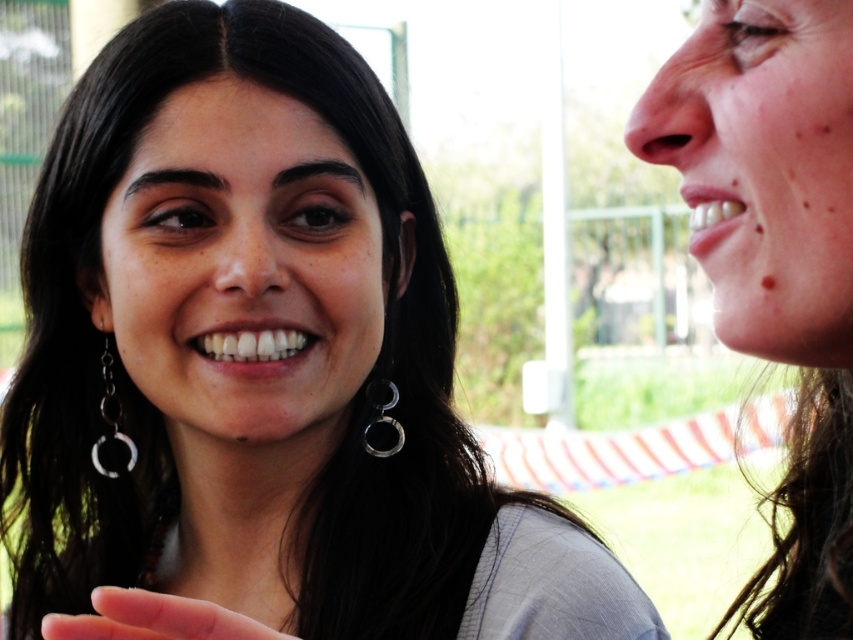
Question: Among these objects, which one is farthest from the camera?

Choices:
 (A) silver metallic earring at left
 (B) smooth skin hand at lower left
 (C) smooth skin face at right

Answer: (A)

Question: Is smooth skin face at right smaller than smooth skin hand at lower left?

Choices:
 (A) yes
 (B) no

Answer: (B)

Question: Estimate the real-world distances between objects in this image. Which object is farther from the smooth skin hand at lower left?

Choices:
 (A) smooth skin face at right
 (B) silver metallic earring at left

Answer: (B)

Question: Which point is farther to the camera?

Choices:
 (A) (183, 625)
 (B) (764, 189)
 (C) (105, 432)

Answer: (C)

Question: Does smooth skin face at right have a smaller size compared to silver metallic earring at left?

Choices:
 (A) yes
 (B) no

Answer: (B)

Question: Does smooth skin face at right have a greater width compared to silver metallic earring at left?

Choices:
 (A) no
 (B) yes

Answer: (B)